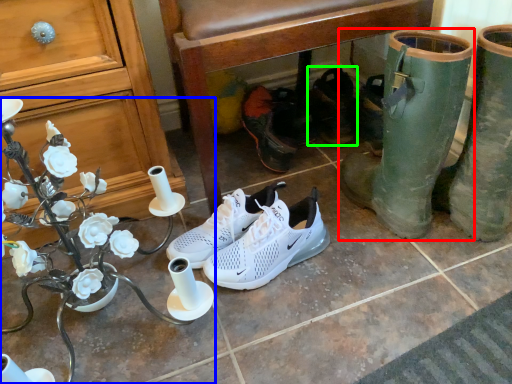
Question: Which object is the farthest from footwear (highlighted by a red box)? Choose among these: desk (highlighted by a blue box) or footwear (highlighted by a green box).

Choices:
 (A) desk
 (B) footwear

Answer: (A)